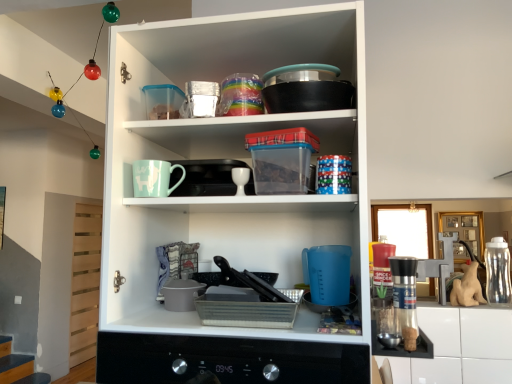
Question: Considering the relative positions of matte white cupboard at center and shiny metallic container at upper center, which is the 2th tableware from right to left, in the image provided, is matte white cupboard at center to the left or to the right of shiny metallic container at upper center, which is the 2th tableware from right to left,?

Choices:
 (A) right
 (B) left

Answer: (A)

Question: Is matte white cupboard at center bigger or smaller than shiny metallic container at upper center, which is the 2th tableware from right to left?

Choices:
 (A) big
 (B) small

Answer: (A)

Question: Estimate the real-world distances between objects in this image. Which object is farther from the metallic black tray at center, which appears as the first appliance when viewed from the top?

Choices:
 (A) transparent plastic bottle at right
 (B) white glossy egg cup at center, placed as the 2th tableware when sorted from left to right
 (C) shiny metallic container at upper center, positioned as the second tableware in bottom-to-top order
 (D) metallic black oven at center
 (E) matte white cupboard at center

Answer: (A)

Question: Considering the real-world distances, which object is closest to the metallic silver tray at lower center, the 1th appliance positioned from the bottom?

Choices:
 (A) shiny metallic container at upper center, which is the 2th tableware from right to left
 (B) white glossy egg cup at center, the 1th tableware viewed from the right
 (C) matte ceramic mug at upper center
 (D) metallic black oven at center
 (E) matte white cupboard at center

Answer: (D)